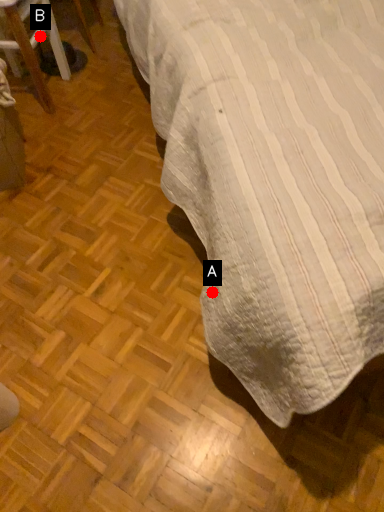
Question: Two points are circled on the image, labeled by A and B beside each circle. Which point appears farthest from the camera in this image?

Choices:
 (A) A is further
 (B) B is further

Answer: (B)